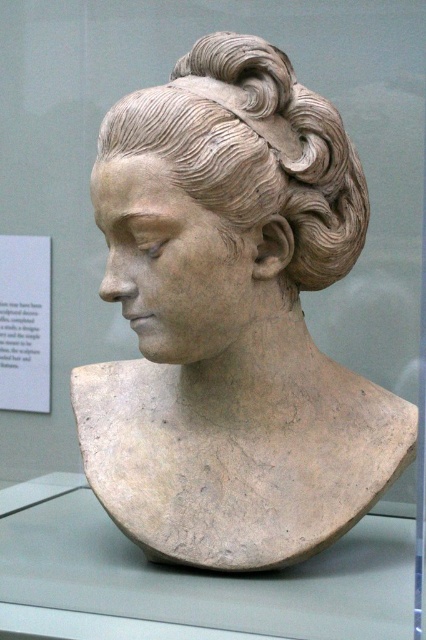
Question: Is matte clay bust at center smaller than matte clay hair bun at center?

Choices:
 (A) yes
 (B) no

Answer: (B)

Question: Is matte clay bust at center to the left of matte clay hair bun at center from the viewer's perspective?

Choices:
 (A) no
 (B) yes

Answer: (B)

Question: Which point is closer to the camera?

Choices:
 (A) matte clay bust at center
 (B) matte clay hair bun at center

Answer: (B)

Question: Can you confirm if matte clay bust at center is smaller than matte clay hair bun at center?

Choices:
 (A) yes
 (B) no

Answer: (B)

Question: Which point appears farthest from the camera in this image?

Choices:
 (A) (226, 138)
 (B) (270, 84)

Answer: (B)